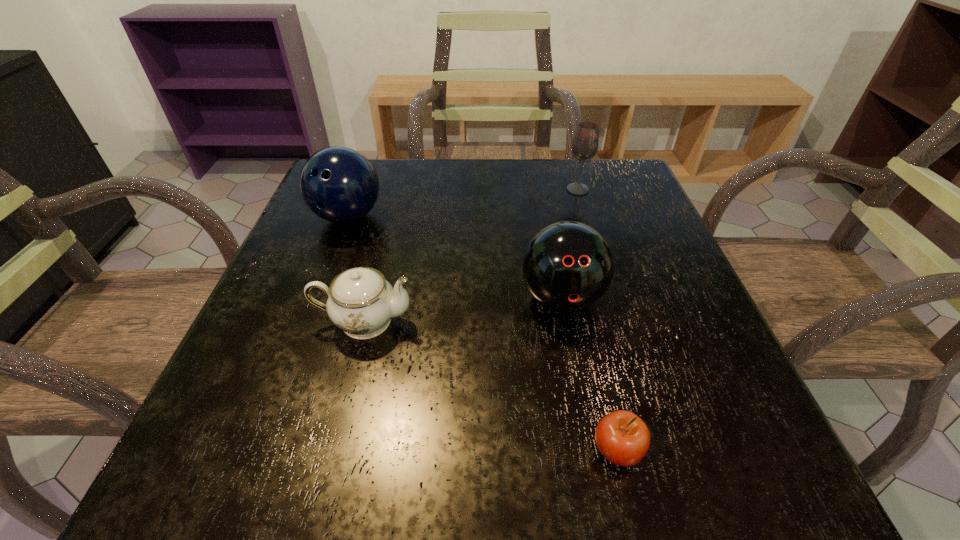
Where is `free space located 0.160m at the spout of the chinaware`? free space located 0.160m at the spout of the chinaware is located at coordinates point(511,321).

The width and height of the screenshot is (960, 540). I want to click on vacant space located 0.300m on the left of the nearest object, so click(357, 450).

This screenshot has width=960, height=540. Identify the location of glass drink container situated at the far edge. point(585,143).

Find the location of a particular element. bowling ball positioned at the far edge is located at coordinates (339, 184).

This screenshot has height=540, width=960. What are the coordinates of `object at the near edge` in the screenshot? It's located at (622, 437).

This screenshot has width=960, height=540. Find the location of `bowling ball present at the left edge`. bowling ball present at the left edge is located at coordinates tap(339, 184).

The width and height of the screenshot is (960, 540). What are the coordinates of `chinaware that is at the left edge` in the screenshot? It's located at (360, 301).

I want to click on glass drink container located at the right edge, so click(x=585, y=143).

I want to click on bowling ball present at the right edge, so click(x=567, y=265).

The image size is (960, 540). What are the coordinates of `object at the far left corner` in the screenshot? It's located at (339, 184).